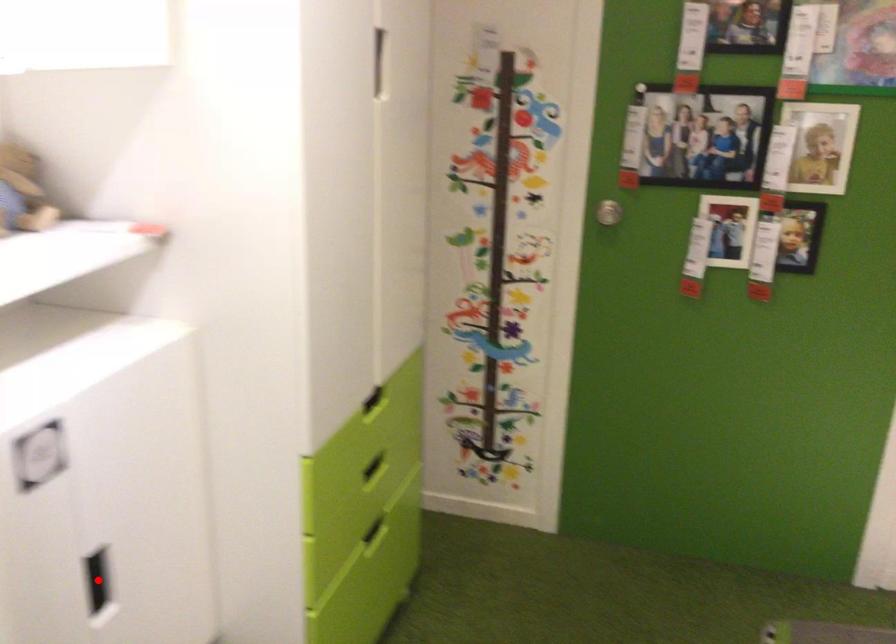
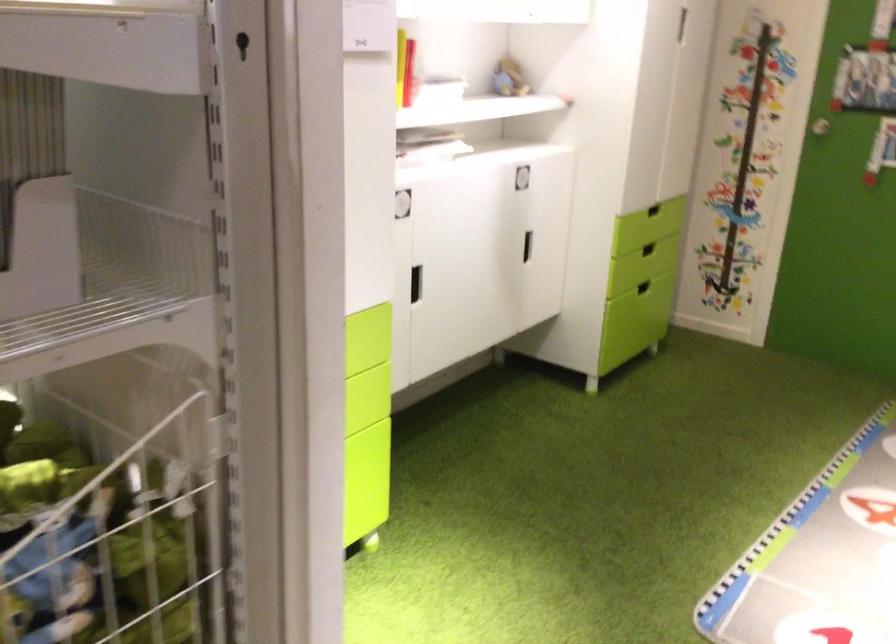
Question: I am providing you with two images of the same scene from different viewpoints. A red point is marked on the first image. Is the red point's position out of view in image 2?

Choices:
 (A) Yes
 (B) No

Answer: (A)